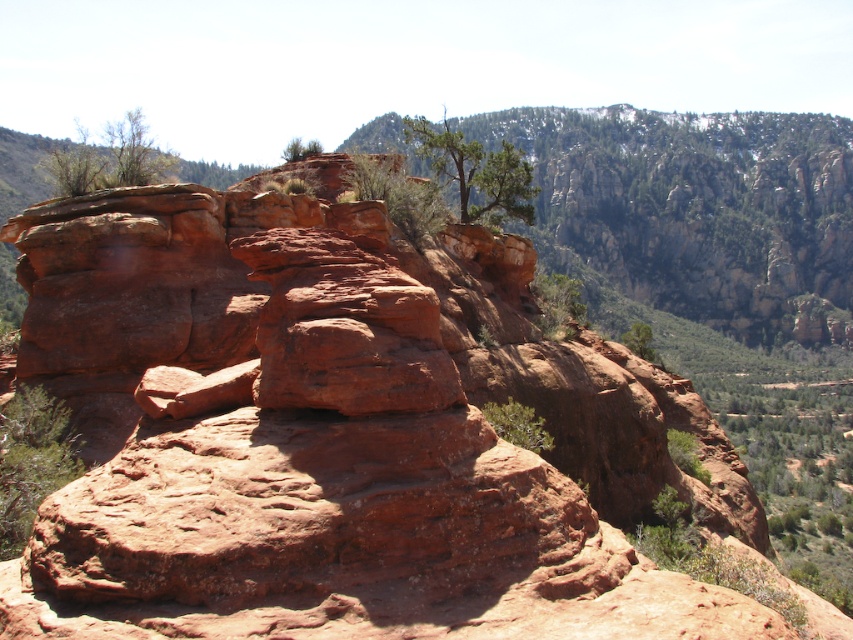
Can you confirm if green leafy tree at upper left is taller than green leafy shrub at upper left?

Yes, green leafy tree at upper left is taller than green leafy shrub at upper left.

Who is lower down, green leafy tree at upper left or green leafy shrub at upper left?

green leafy shrub at upper left

Between point (131, 112) and point (57, 150), which one is positioned in front?

Point (57, 150)

Locate an element on the screen. green leafy tree at upper left is located at coordinates (132, 154).

Can you confirm if green leafy tree at lower left is wider than green leafy shrub at upper left?

No.

This screenshot has width=853, height=640. I want to click on green leafy tree at lower left, so click(32, 460).

Locate an element on the screen. This screenshot has width=853, height=640. green leafy tree at lower left is located at coordinates (32, 460).

Can you confirm if green leafy shrub at upper left is positioned above green leafy tree at center?

Yes.

Between point (80, 141) and point (538, 444), which one is positioned behind?

The point (80, 141) is more distant.

Identify the location of green leafy shrub at upper left. This screenshot has width=853, height=640. (74, 168).